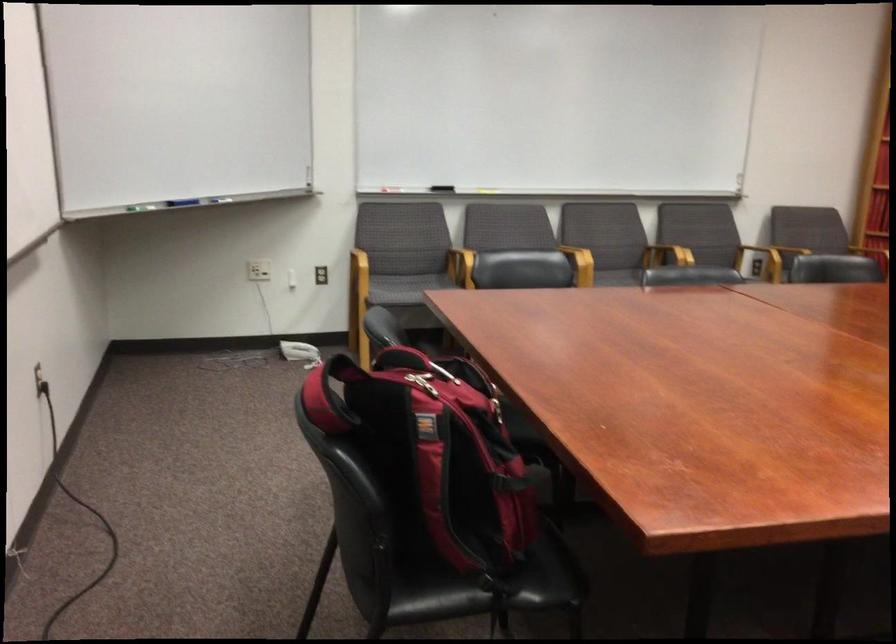
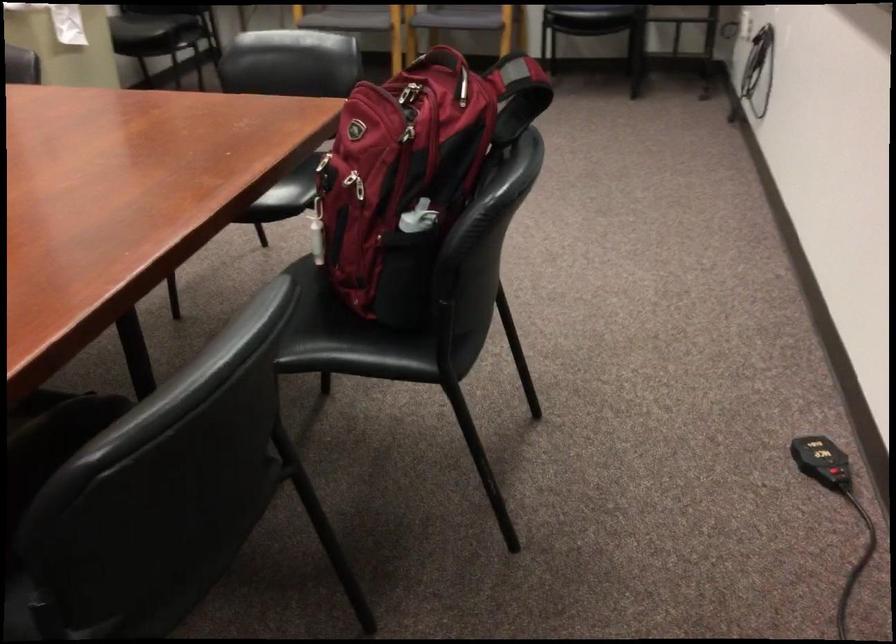
The point at (543, 413) is marked in the first image. Where is the corresponding point in the second image?

(355, 184)